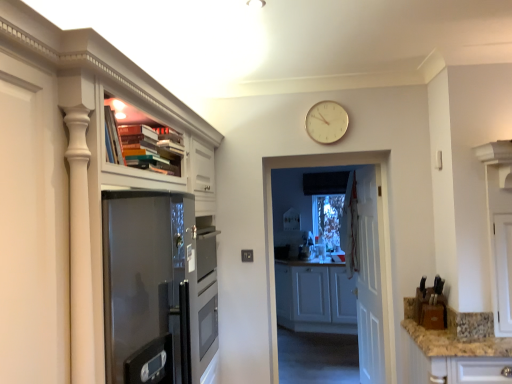
What are the coordinates of `vacant area situated to the left side of granite countertop at lower right` in the screenshot? It's located at [450, 336].